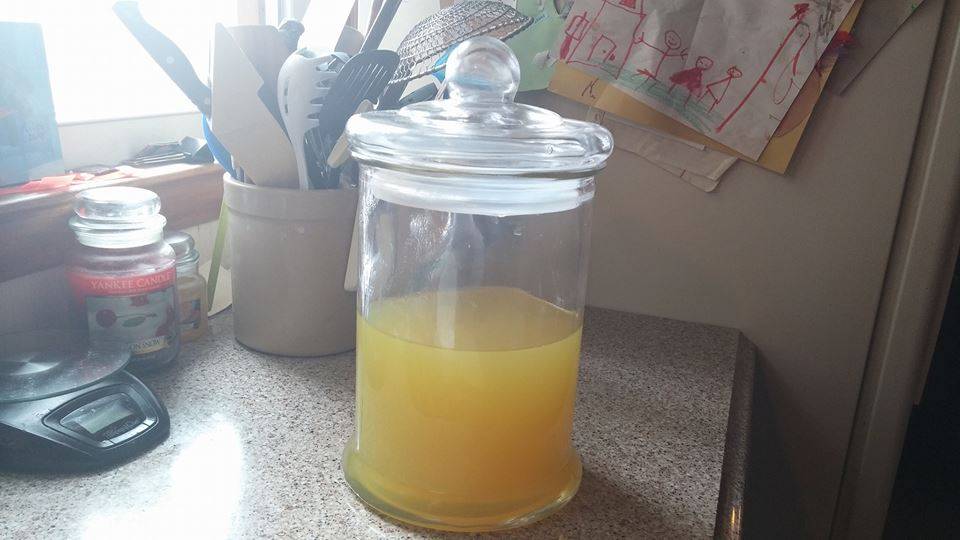
Image resolution: width=960 pixels, height=540 pixels. What are the coordinates of `1 fridge` in the screenshot? It's located at (847, 260).